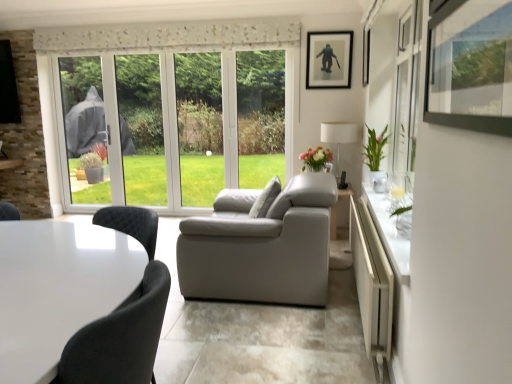
Question: Should I look upward or downward to see green glossy vase at right?

Choices:
 (A) up
 (B) down

Answer: (A)

Question: Is white fabric lampshade at right positioned behind green glossy vase at right?

Choices:
 (A) yes
 (B) no

Answer: (A)

Question: From a real-world perspective, is white fabric lampshade at right located higher than green glossy vase at right?

Choices:
 (A) no
 (B) yes

Answer: (A)

Question: Is white fabric lampshade at right far from green glossy vase at right?

Choices:
 (A) yes
 (B) no

Answer: (B)

Question: Is white fabric lampshade at right outside of green glossy vase at right?

Choices:
 (A) no
 (B) yes

Answer: (B)

Question: From the image's perspective, is white fabric lampshade at right beneath green glossy vase at right?

Choices:
 (A) yes
 (B) no

Answer: (B)

Question: From the image's perspective, does white fabric lampshade at right appear higher than green glossy vase at right?

Choices:
 (A) no
 (B) yes

Answer: (B)

Question: Could you tell me if white glossy table at lower left is facing matte floral arrangement at center?

Choices:
 (A) no
 (B) yes

Answer: (A)

Question: From a real-world perspective, does white glossy table at lower left sit lower than matte floral arrangement at center?

Choices:
 (A) yes
 (B) no

Answer: (A)

Question: Does white glossy table at lower left come behind matte floral arrangement at center?

Choices:
 (A) yes
 (B) no

Answer: (B)

Question: Is matte floral arrangement at center a part of white glossy table at lower left?

Choices:
 (A) yes
 (B) no

Answer: (B)

Question: From a real-world perspective, is white glossy table at lower left positioned over matte floral arrangement at center based on gravity?

Choices:
 (A) yes
 (B) no

Answer: (B)

Question: Can you see white glossy table at lower left touching matte floral arrangement at center?

Choices:
 (A) no
 (B) yes

Answer: (A)

Question: Can you confirm if white fabric lampshade at right is smaller than white glossy table at lower left?

Choices:
 (A) no
 (B) yes

Answer: (B)